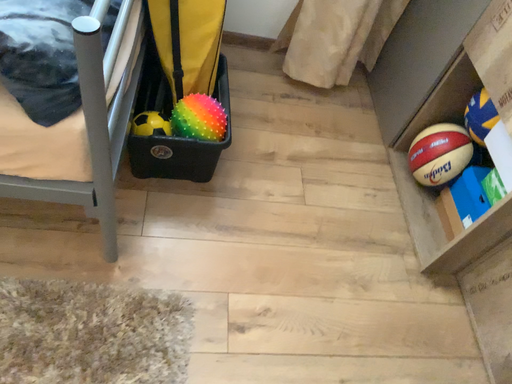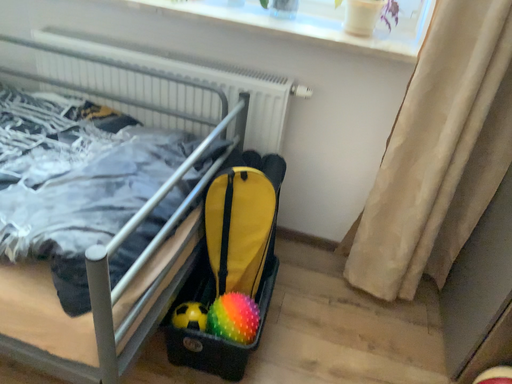
Question: Which way did the camera rotate in the video?

Choices:
 (A) rotated left
 (B) rotated right

Answer: (A)